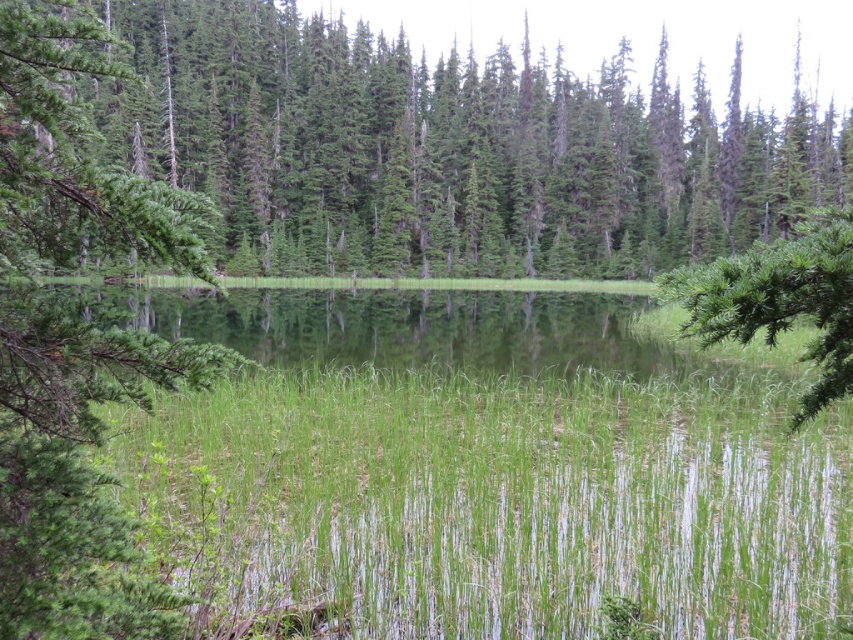
You are standing at the edge of the water in the serene landscape and notice two points marked in the image. The first point is at coordinate point [10,577] and the second is at point [755,262]. Which point is closer to you as you stand at the water edge?

Point [10,577] is closer to you than point [755,262] because it is further to the viewer, meaning it lies in a position that is nearer to your vantage point at the water edge.